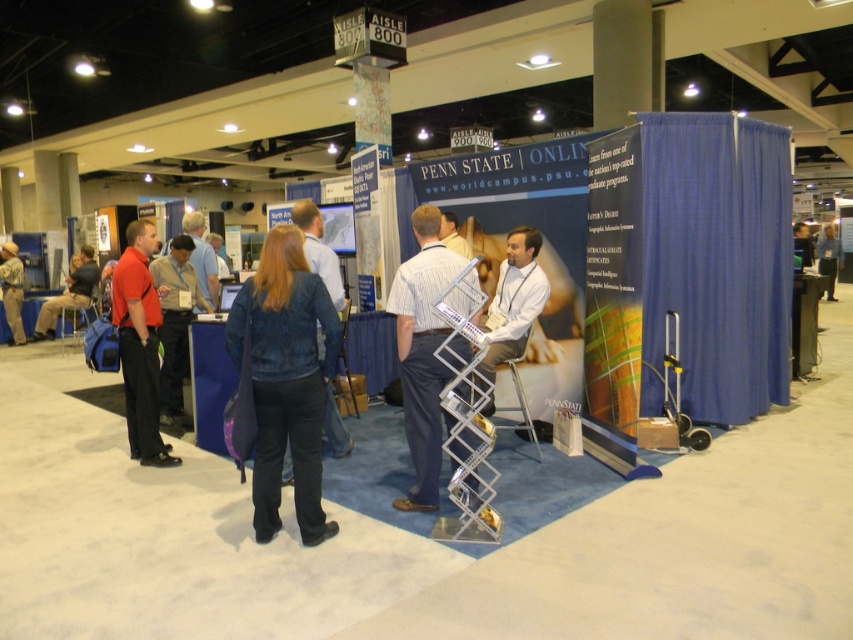
You are standing at the Penn State Online booth and want to move from the laptop table to the display rack. The laptop table is at point (51,312) and the display rack is at point (322,324). Which direction should you move to reach the display rack?

You should move towards the display rack at point (322,324) because it is closer to you than the laptop table at point (51,312).

What is located at the point with coordinates (514, 300) in the image?

The white shirt at center is located at point (514, 300).